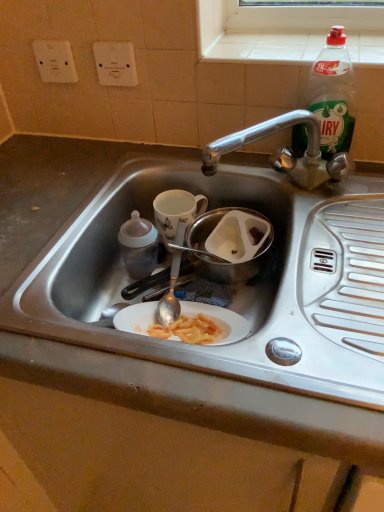
Question: Should I look upward or downward to see stainless steel sink at center?

Choices:
 (A) up
 (B) down

Answer: (B)

Question: Could you tell me if stainless steel sink at center is facing metallic stainless steel bowl at center?

Choices:
 (A) yes
 (B) no

Answer: (B)

Question: Is metallic stainless steel bowl at center at the back of stainless steel sink at center?

Choices:
 (A) yes
 (B) no

Answer: (A)

Question: Is stainless steel sink at center behind metallic stainless steel bowl at center?

Choices:
 (A) yes
 (B) no

Answer: (B)

Question: From the image's perspective, does stainless steel sink at center appear lower than metallic stainless steel bowl at center?

Choices:
 (A) yes
 (B) no

Answer: (A)

Question: Can you confirm if stainless steel sink at center is shorter than metallic stainless steel bowl at center?

Choices:
 (A) yes
 (B) no

Answer: (B)

Question: Is stainless steel sink at center closer to camera compared to metallic stainless steel bowl at center?

Choices:
 (A) no
 (B) yes

Answer: (B)

Question: Can you confirm if white plastic electric outlet at upper left, which is the 1th electric outlet in left-to-right order, is bigger than green plastic bottle at upper right, which is the second bottle from left to right?

Choices:
 (A) no
 (B) yes

Answer: (A)

Question: Is white plastic electric outlet at upper left, acting as the second electric outlet starting from the right, thinner than green plastic bottle at upper right, placed as the 2th bottle when sorted from bottom to top?

Choices:
 (A) yes
 (B) no

Answer: (A)

Question: Can you see white plastic electric outlet at upper left, acting as the second electric outlet starting from the right, touching green plastic bottle at upper right, which is the second bottle from left to right?

Choices:
 (A) yes
 (B) no

Answer: (B)

Question: Is white plastic electric outlet at upper left, acting as the second electric outlet starting from the right, turned away from green plastic bottle at upper right, the first bottle in the right-to-left sequence?

Choices:
 (A) no
 (B) yes

Answer: (A)

Question: Does white plastic electric outlet at upper left, which is the 1th electric outlet in left-to-right order, have a greater height compared to green plastic bottle at upper right, which ranks as the first bottle in top-to-bottom order?

Choices:
 (A) yes
 (B) no

Answer: (B)

Question: Is the position of white plastic electric outlet at upper left, which is the 1th electric outlet in left-to-right order, more distant than that of green plastic bottle at upper right, which is the second bottle from left to right?

Choices:
 (A) no
 (B) yes

Answer: (B)

Question: Does white plastic socket at upper center, which is the first electric outlet in right-to-left order, lie behind green plastic bottle at upper right, which ranks as the first bottle in top-to-bottom order?

Choices:
 (A) yes
 (B) no

Answer: (A)